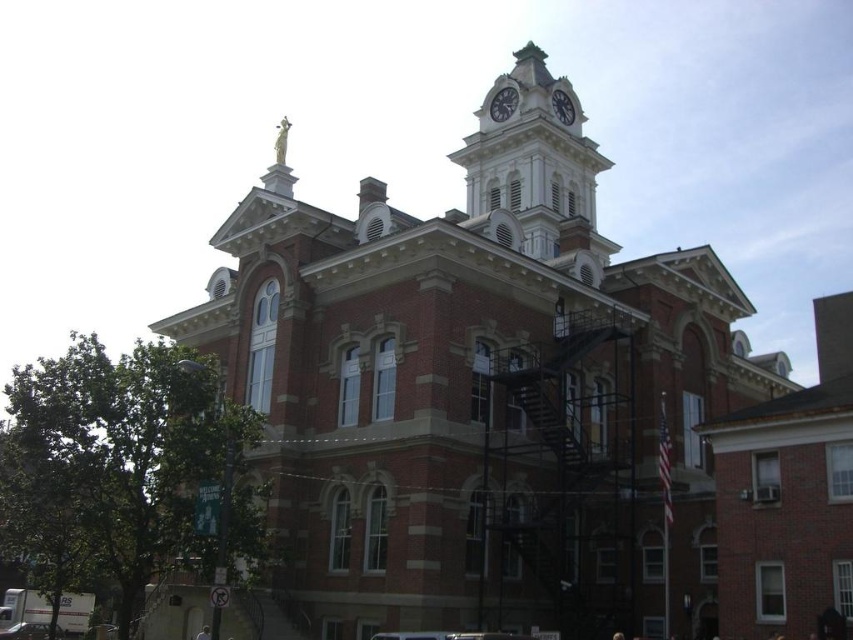
You are an architect examining the building. You need to determine the spatial relationship between the red brick church at center and the white glossy clock at upper center. Which object is positioned higher in the image?

The white glossy clock at upper center is positioned higher than the red brick church at center.